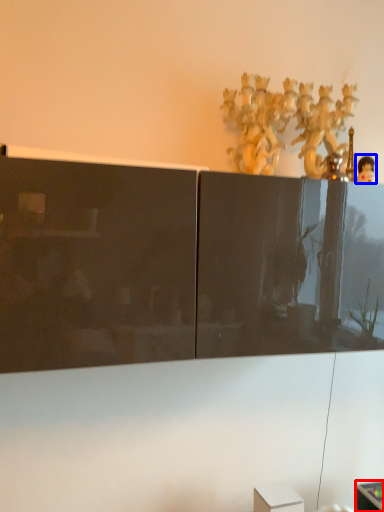
Question: Among these objects, which one is nearest to the camera, furniture (highlighted by a red box) or toy (highlighted by a blue box)?

Choices:
 (A) furniture
 (B) toy

Answer: (B)